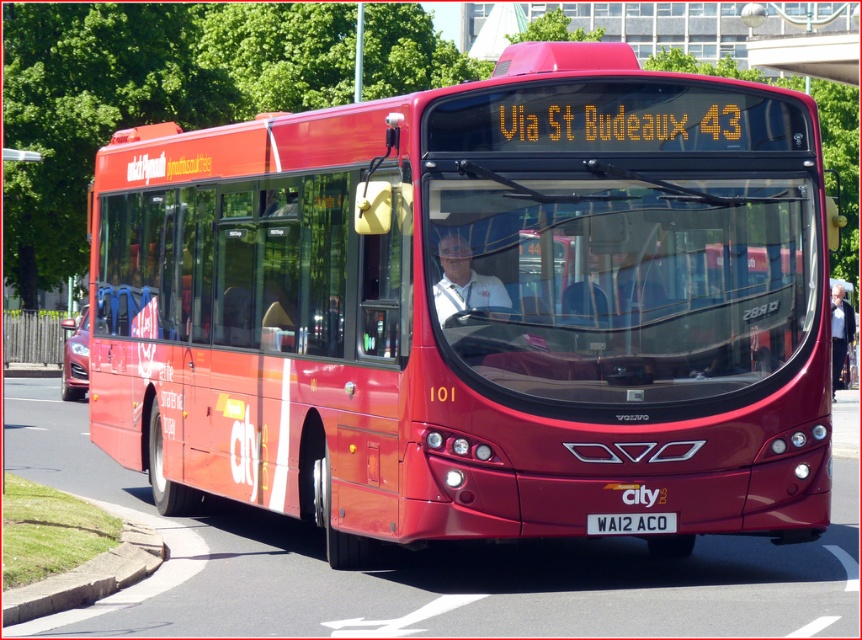
You are a pedestrian standing on the sidewalk next to the road where the matte red bus at center and the white fabric jacket at center are located. If you look down from the bus, which object would you see directly below it?

The matte red bus at center is located above the white fabric jacket at center, so if you look down from the bus, you would see the white fabric jacket at center directly below it.

You are standing in front of the red Volvo bus model 101. There are two points marked on the bus, one at coordinates point (492, 305) and another at point (845, 301). Which of these points is nearer to your viewpoint?

Point (492, 305) is closer to the camera than point (845, 301), so the point at coordinates point (492, 305) is nearer to your viewpoint.

You are a delivery person trying to attach a package to the white plastic license plate at center and the white fabric jacket at center. Which object will allow you to attach a larger package?

The white fabric jacket at center can hold a larger package because it has a greater width than the white plastic license plate at center.